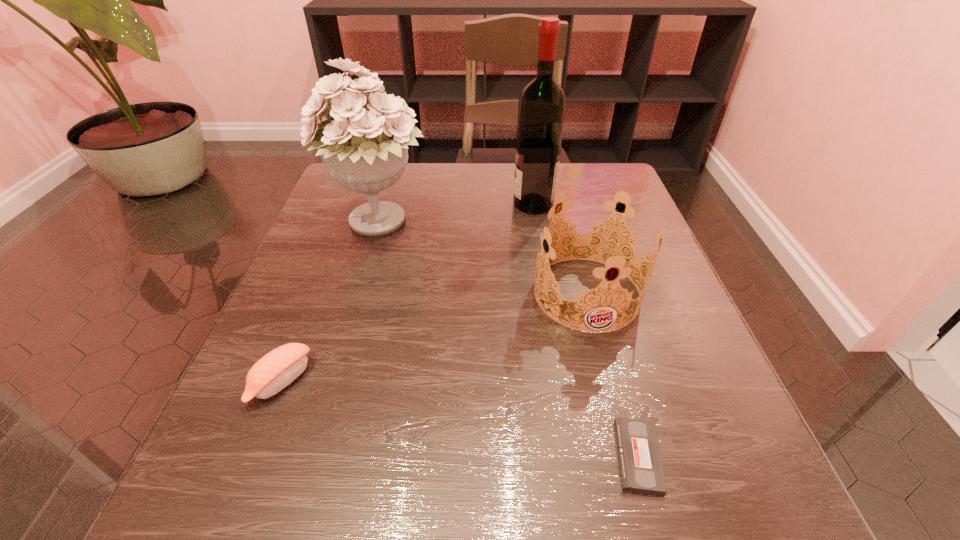
Where is `unoccupied position between the shortest object and the bouquet`? unoccupied position between the shortest object and the bouquet is located at coordinates (509, 340).

The width and height of the screenshot is (960, 540). I want to click on vacant space that is in between the bouquet and the shortest object, so click(509, 340).

Find the location of `vacant space in between the videotape and the crown`. vacant space in between the videotape and the crown is located at coordinates (612, 374).

Locate an element on the screen. empty space between the bouquet and the fourth farthest object is located at coordinates (330, 303).

The height and width of the screenshot is (540, 960). I want to click on vacant area that lies between the crown and the second shortest object, so click(x=434, y=337).

What are the coordinates of `empty space between the crown and the bouquet` in the screenshot? It's located at (483, 259).

You are a GUI agent. You are given a task and a screenshot of the screen. Output one action in this format:
    pyautogui.click(x=<x>, y=<y>)
    Task: Click on the free space between the bouquet and the third tallest object
    
    Given the screenshot: What is the action you would take?
    (483, 259)

Choose which object is the third nearest neighbor to the third farthest object. Please provide its 2D coordinates. Your answer should be formatted as a tuple, i.e. [(x, y)], where the tuple contains the x and y coordinates of a point satisfying the conditions above.

[(364, 150)]

Where is `object that is the second closest one to the alcohol`? The image size is (960, 540). object that is the second closest one to the alcohol is located at coordinates (364, 150).

Find the location of a particular element. The height and width of the screenshot is (540, 960). free location that satisfies the following two spatial constraints: 1. on the front and back of the alcohol; 2. on the left side of the third shortest object is located at coordinates (548, 293).